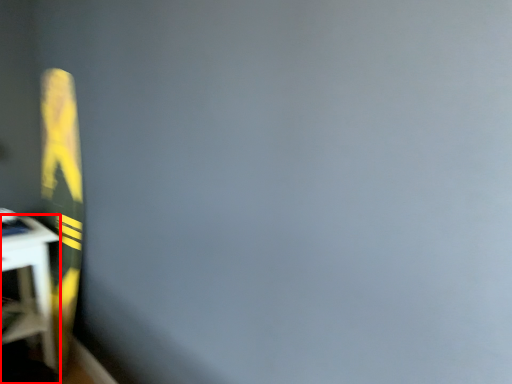
Question: Where is furniture (annotated by the red box) located in relation to bulletin board in the image?

Choices:
 (A) left
 (B) right

Answer: (A)